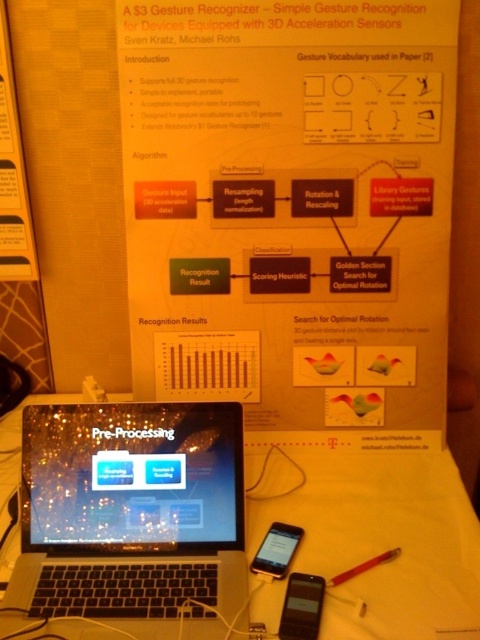
You are standing in front of the poster board at the tech event. You notice two points labeled on the poster. The first point is at coordinates point (92, 413) and the second is at point (288, 540). Which of these points appears closer to you when looking at the poster?

Point (288, 540) appears closer to you because it is less further to the camera than point (92, 413), according to the description.

Based on the scene described, which smartphone is taller, the black matte smartphone at lower right or the matte black smartphone at lower center?

The matte black smartphone at lower center is taller than the black matte smartphone at lower right.

You are standing in front of the poster board and notice two points labeled on the diagram. Which point, point (323,592) or point (285,534), is closer to you?

Point (323,592) is closer to the viewer than point (285,534).